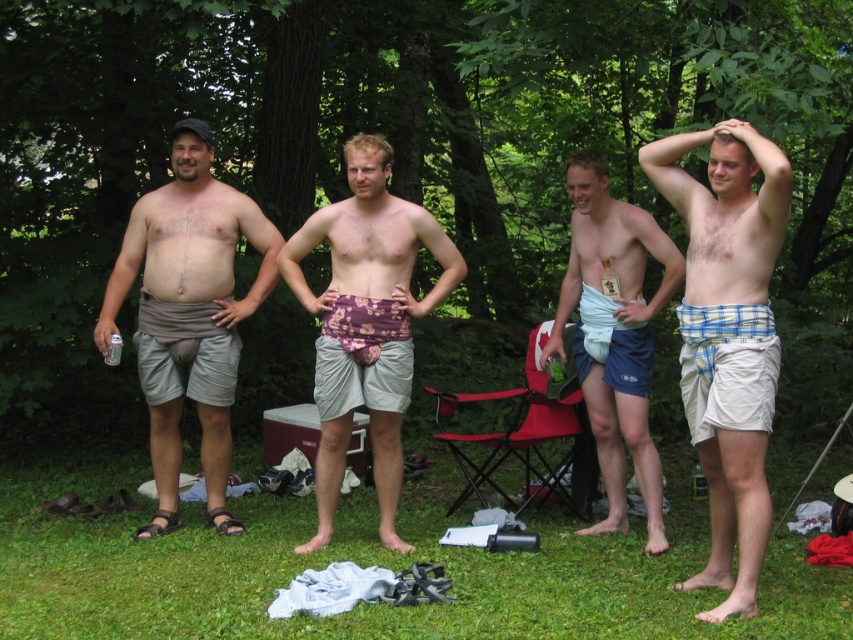
You are a photographer trying to capture a photo of the plaid cotton shorts at right. Based on their position in the image, can you estimate whether they are closer to the top or bottom of the frame?

The plaid cotton shorts at right is located at point (728, 333). Since the y coordinate is 0.855, which is closer to 1.0, they are near the bottom of the frame.

You are a photographer trying to capture a candid shot of the group. You notice the white fabric towel at center and the blonde hair at center. Which object should you adjust your camera focus to first if you want to ensure both are in frame but prioritize the one closer to the lens?

The white fabric towel at center is to the right of blonde hair at center, so you should focus on the blonde hair at center first as it is closer to the lens.